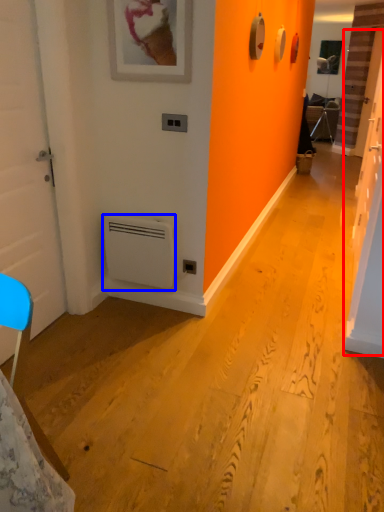
Question: Which point is further to the camera, door (highlighted by a red box) or air conditioning (highlighted by a blue box)?

Choices:
 (A) door
 (B) air conditioning

Answer: (B)